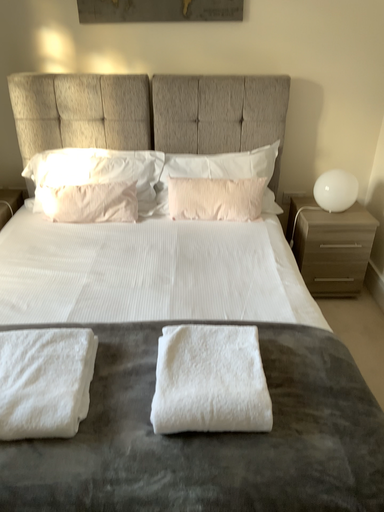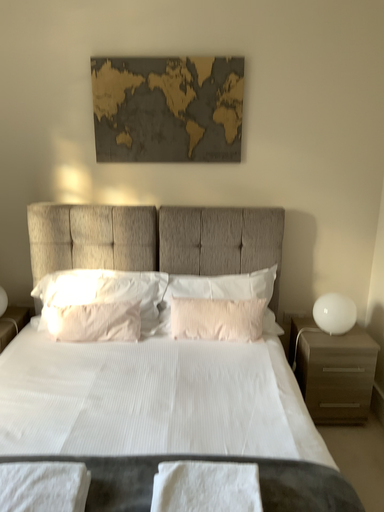
Question: Which way did the camera rotate in the video?

Choices:
 (A) rotated upward
 (B) rotated downward

Answer: (A)